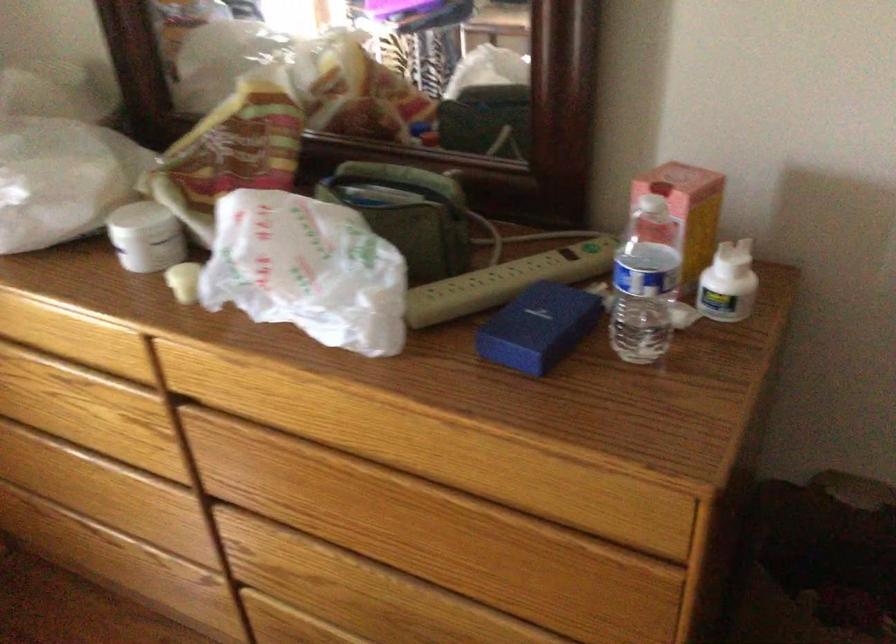
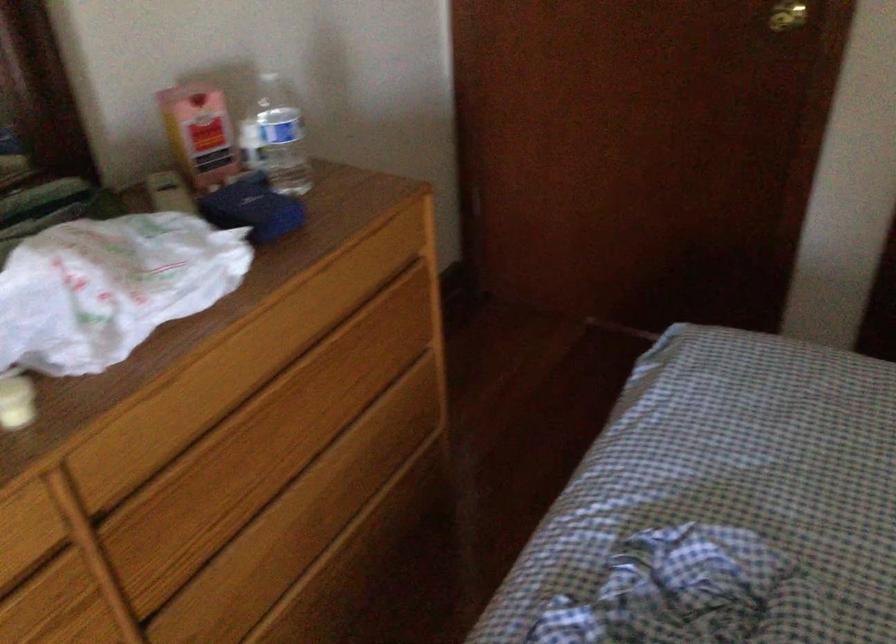
Locate, in the second image, the point that corresponds to the point at 378,509 in the first image.

(291, 413)